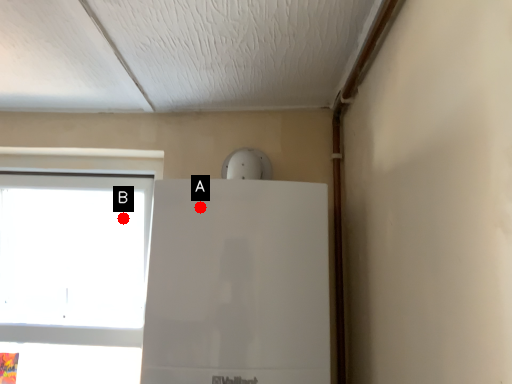
Question: Two points are circled on the image, labeled by A and B beside each circle. Which of the following is the closest to the observer?

Choices:
 (A) A is closer
 (B) B is closer

Answer: (A)